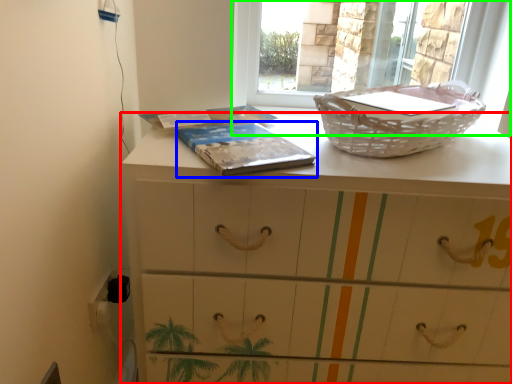
Question: Based on their relative distances, which object is farther from chest of drawers (highlighted by a red box)? Choose from paperback book (highlighted by a blue box) and window (highlighted by a green box).

Choices:
 (A) paperback book
 (B) window

Answer: (B)